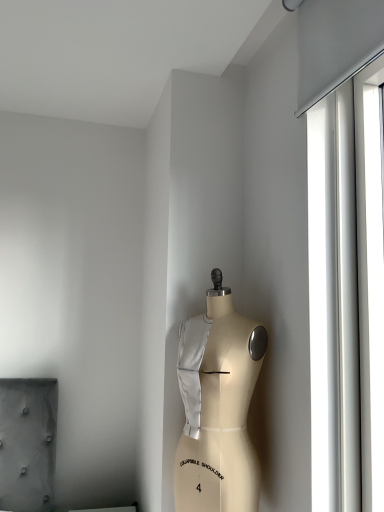
Identify the location of transparent glass shop window at right. (346, 295).

Describe the element at coordinates (346, 295) in the screenshot. Image resolution: width=384 pixels, height=512 pixels. I see `transparent glass shop window at right` at that location.

What are the coordinates of `transparent glass shop window at right` in the screenshot? It's located at (346, 295).